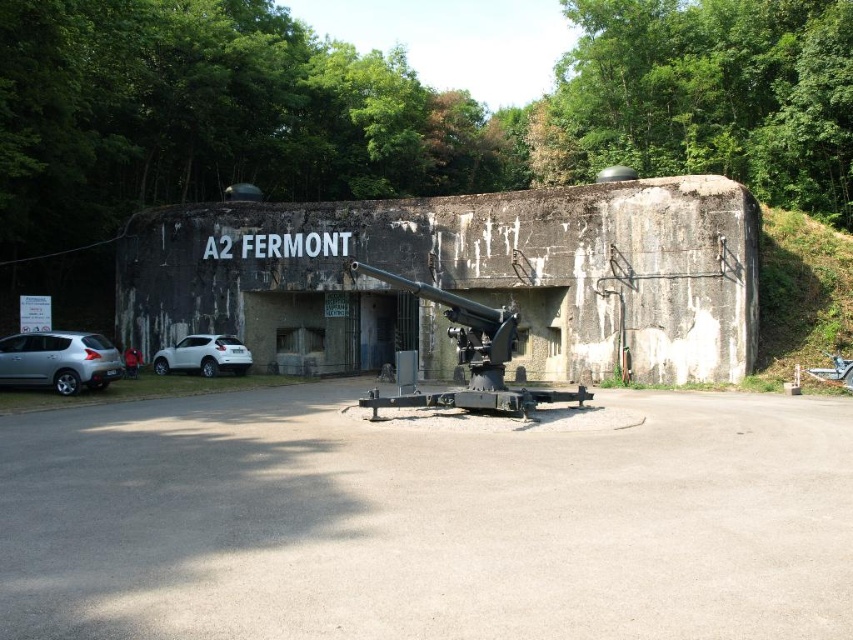
Question: Is gray asphalt parking lot at center positioned before white matte suv at lower left?

Choices:
 (A) yes
 (B) no

Answer: (A)

Question: Which of the following is the closest to the observer?

Choices:
 (A) (503, 397)
 (B) (22, 337)
 (C) (219, 342)

Answer: (A)

Question: Based on their relative distances, which object is nearer to the black matte cannon at center?

Choices:
 (A) satin silver car at lower left
 (B) white matte suv at lower left
 (C) weathered concrete bunker at center

Answer: (C)

Question: Which point appears farthest from the camera in this image?

Choices:
 (A) (91, 572)
 (B) (567, 326)
 (C) (503, 392)
 (D) (115, 353)

Answer: (B)

Question: From the image, what is the correct spatial relationship of gray asphalt parking lot at center in relation to satin silver car at lower left?

Choices:
 (A) above
 (B) below

Answer: (B)

Question: Does gray asphalt parking lot at center have a smaller size compared to weathered concrete bunker at center?

Choices:
 (A) yes
 (B) no

Answer: (A)